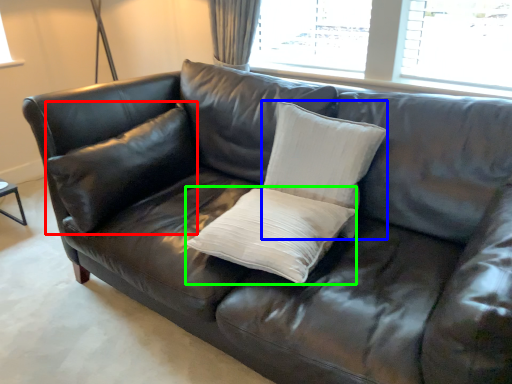
Question: Considering the real-world distances, which object is farthest from pillow (highlighted by a red box)? pillow (highlighted by a blue box) or pillow (highlighted by a green box)?

Choices:
 (A) pillow
 (B) pillow

Answer: (A)